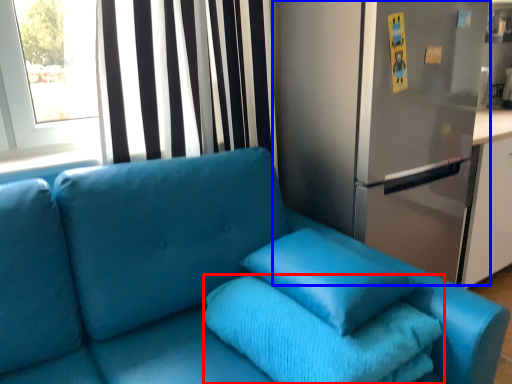
Question: Which object appears farthest to the camera in this image, bath towel (highlighted by a red box) or fridge (highlighted by a blue box)?

Choices:
 (A) bath towel
 (B) fridge

Answer: (B)